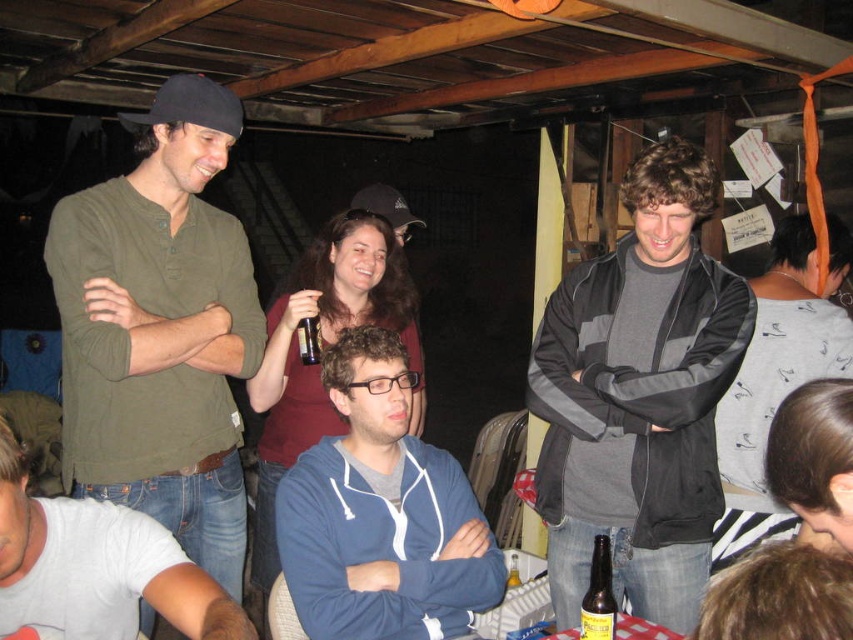
You are at a party and want to pour the contents of the brown glass bottle at center into the black plastic cup at center. Will the cup hold all the liquid from the bottle?

The brown glass bottle at center has a larger width than the black plastic cup at center, so it is possible that the cup may not hold all the liquid from the bottle depending on their capacities. However, the width alone does not determine capacity, so you should check the volume of both containers to be sure.